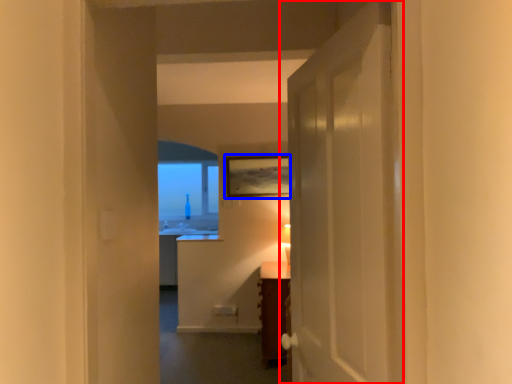
Question: Which point is closer to the camera, door (highlighted by a red box) or picture frame (highlighted by a blue box)?

Choices:
 (A) door
 (B) picture frame

Answer: (A)